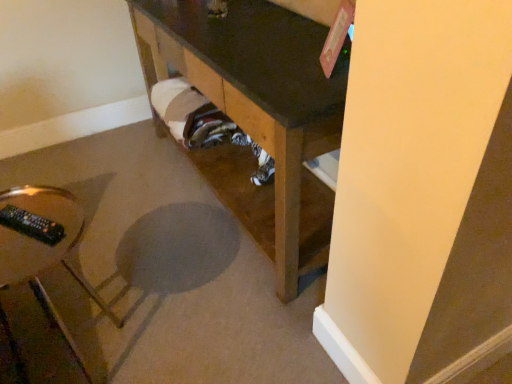
Image resolution: width=512 pixels, height=384 pixels. I want to click on vacant space situated above brown wood table at lower center, acting as the second furniture starting from the left (from a real-world perspective), so click(x=265, y=38).